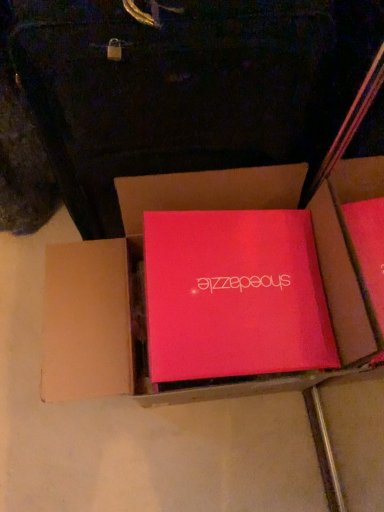
Question: Is matte pink box at center, arranged as the 2th box when viewed from the left, spatially inside matte red box at center, which is the 2th box from right to left, or outside of it?

Choices:
 (A) inside
 (B) outside

Answer: (A)

Question: Considering the positions of matte pink box at center, the 1th box in the right-to-left sequence, and matte red box at center, which is the 2th box from right to left, in the image, is matte pink box at center, the 1th box in the right-to-left sequence, bigger or smaller than matte red box at center, which is the 2th box from right to left,?

Choices:
 (A) small
 (B) big

Answer: (A)

Question: From the image's perspective, is matte pink box at center, the 1th box in the right-to-left sequence, located above or below matte red box at center, which is the 2th box from right to left?

Choices:
 (A) below
 (B) above

Answer: (B)

Question: Relative to matte pink box at center, the 1th box in the right-to-left sequence, is matte red box at center, which is the 2th box from right to left, in front or behind?

Choices:
 (A) front
 (B) behind

Answer: (A)

Question: Considering the positions of matte red box at center, the 1th box viewed from the left, and matte pink box at center, arranged as the 2th box when viewed from the left, in the image, is matte red box at center, the 1th box viewed from the left, bigger or smaller than matte pink box at center, arranged as the 2th box when viewed from the left,?

Choices:
 (A) small
 (B) big

Answer: (B)

Question: Considering the positions of matte red box at center, the 1th box viewed from the left, and matte pink box at center, the 1th box in the right-to-left sequence, in the image, is matte red box at center, the 1th box viewed from the left, taller or shorter than matte pink box at center, the 1th box in the right-to-left sequence,?

Choices:
 (A) short
 (B) tall

Answer: (B)

Question: From the image's perspective, is matte red box at center, which is the 2th box from right to left, positioned above or below matte pink box at center, arranged as the 2th box when viewed from the left?

Choices:
 (A) below
 (B) above

Answer: (A)